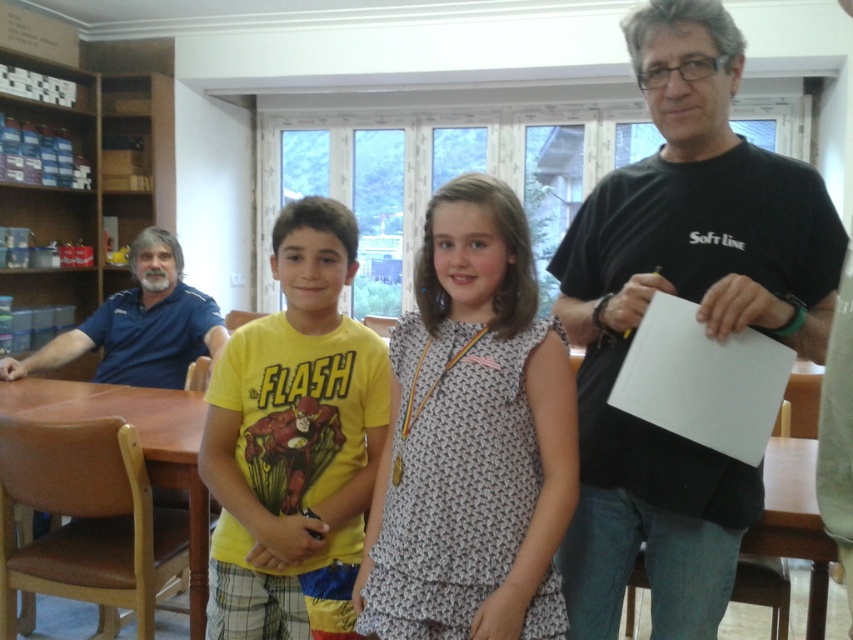
Which is in front, point (164, 292) or point (218, 508)?

Point (218, 508) is in front.

The height and width of the screenshot is (640, 853). Describe the element at coordinates (138, 324) in the screenshot. I see `blue cotton shirt at left` at that location.

You are a GUI agent. You are given a task and a screenshot of the screen. Output one action in this format:
    pyautogui.click(x=<x>, y=<y>)
    Task: Click on the blue cotton shirt at left
    The width and height of the screenshot is (853, 640).
    Given the screenshot: What is the action you would take?
    [x=138, y=324]

Who is more forward, (616, 419) or (386, 422)?

Point (616, 419) is in front.

Does black matte t-shirt at center have a lesser width compared to yellow cotton t-shirt at center?

No.

Between point (633, 177) and point (381, 394), which one is positioned in front?

Point (633, 177) is in front.

This screenshot has height=640, width=853. Identify the location of black matte t-shirt at center. (698, 317).

Does printed cotton dress at center have a larger size compared to brown wooden table at center?

No.

Can you confirm if printed cotton dress at center is positioned to the left of brown wooden table at center?

Incorrect, printed cotton dress at center is not on the left side of brown wooden table at center.

Does point (393, 524) come farther from viewer compared to point (201, 616)?

No, it is not.

Locate an element on the screen. The image size is (853, 640). printed cotton dress at center is located at coordinates (473, 438).